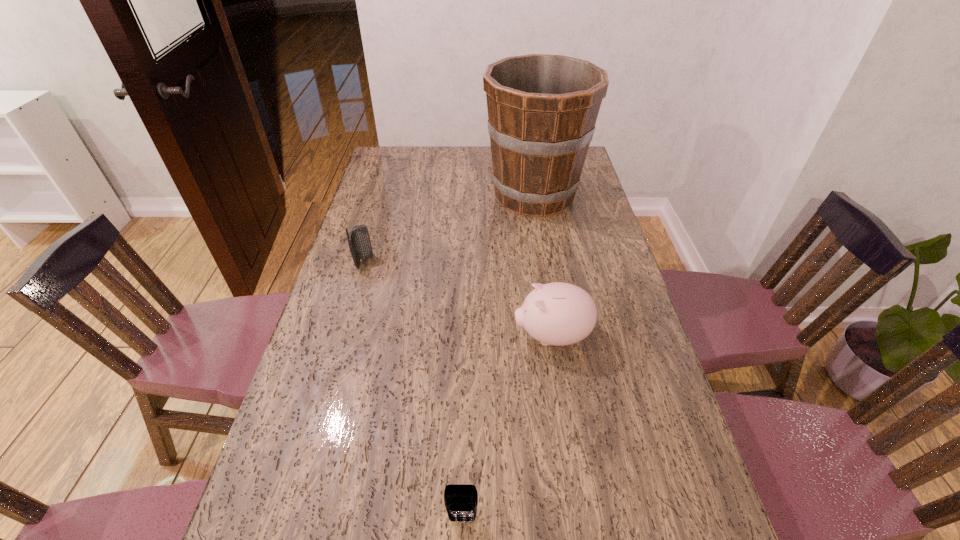
Locate an element on the screen. This screenshot has height=540, width=960. free space at the far left corner of the desktop is located at coordinates (412, 155).

In order to click on vacant area that lies between the second nearest object and the second farthest object in this screenshot , I will do `click(458, 299)`.

This screenshot has width=960, height=540. I want to click on empty space that is in between the second nearest object and the shortest object, so click(507, 428).

Where is `free spot between the tallest object and the farther cellular telephone`? The width and height of the screenshot is (960, 540). free spot between the tallest object and the farther cellular telephone is located at coordinates (449, 228).

The height and width of the screenshot is (540, 960). Find the location of `vacant area between the piggy bank and the left cellular telephone`. vacant area between the piggy bank and the left cellular telephone is located at coordinates (458, 299).

The image size is (960, 540). What are the coordinates of `free space between the shorter cellular telephone and the farthest object` in the screenshot? It's located at (498, 357).

The height and width of the screenshot is (540, 960). What are the coordinates of `vacant area that lies between the bucket and the left cellular telephone` in the screenshot? It's located at (449, 228).

The width and height of the screenshot is (960, 540). Find the location of `free space between the third nearest object and the nearer cellular telephone`. free space between the third nearest object and the nearer cellular telephone is located at coordinates (414, 390).

At what (x,y) coordinates should I click in order to perform the action: click on free spot between the piggy bank and the nearer cellular telephone. Please return your answer as a coordinate pair (x, y). Looking at the image, I should click on (507, 428).

Where is `blank region between the second farthest object and the farthest object`? The image size is (960, 540). blank region between the second farthest object and the farthest object is located at coordinates (449, 228).